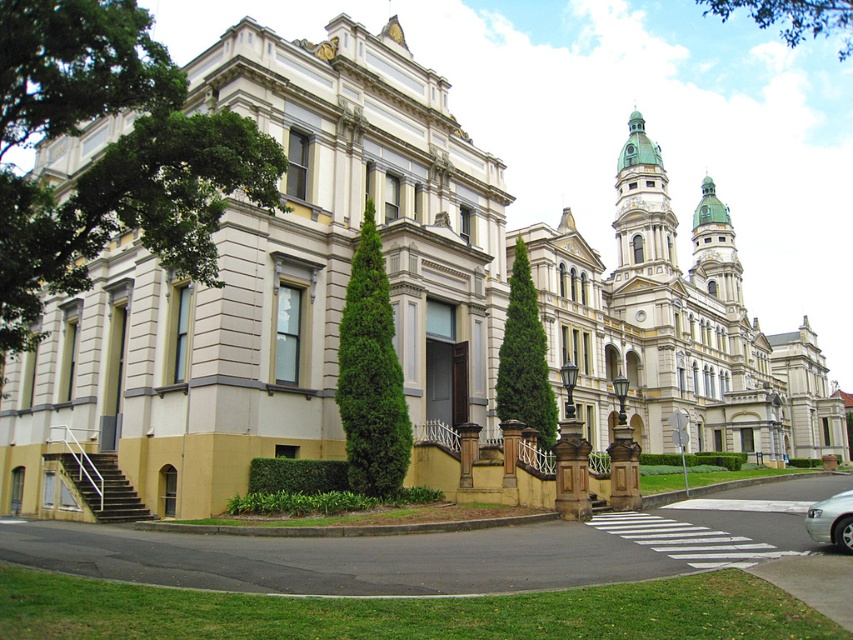
Question: Which object is the closest to the green leafy tree at upper center?

Choices:
 (A) green leafy tree at left
 (B) white stone church at upper center

Answer: (A)

Question: Can you confirm if green leafy tree at left is bigger than green leafy tree at center?

Choices:
 (A) no
 (B) yes

Answer: (B)

Question: Which of the following is the farthest from the observer?

Choices:
 (A) pos(753,10)
 (B) pos(535,336)
 (C) pos(9,333)

Answer: (A)

Question: Which point is farther to the camera?

Choices:
 (A) green leafy tree at left
 (B) white stone church at upper center
 (C) green leafy tree at upper center
 (D) green coniferous tree at center

Answer: (B)

Question: Does green coniferous tree at center appear over green leafy tree at upper center?

Choices:
 (A) no
 (B) yes

Answer: (A)

Question: Does green leafy tree at left appear on the left side of green leafy tree at upper center?

Choices:
 (A) yes
 (B) no

Answer: (A)